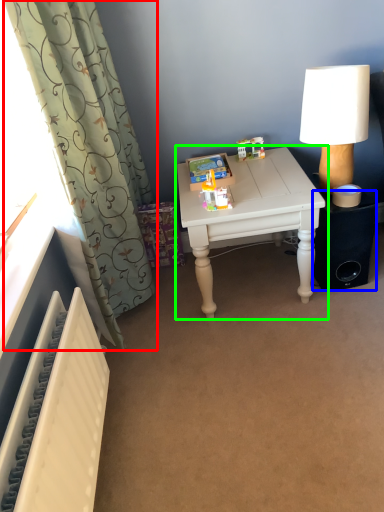
Question: Estimate the real-world distances between objects in this image. Which object is farther from curtain (highlighted by a red box), speaker (highlighted by a blue box) or table (highlighted by a green box)?

Choices:
 (A) speaker
 (B) table

Answer: (A)